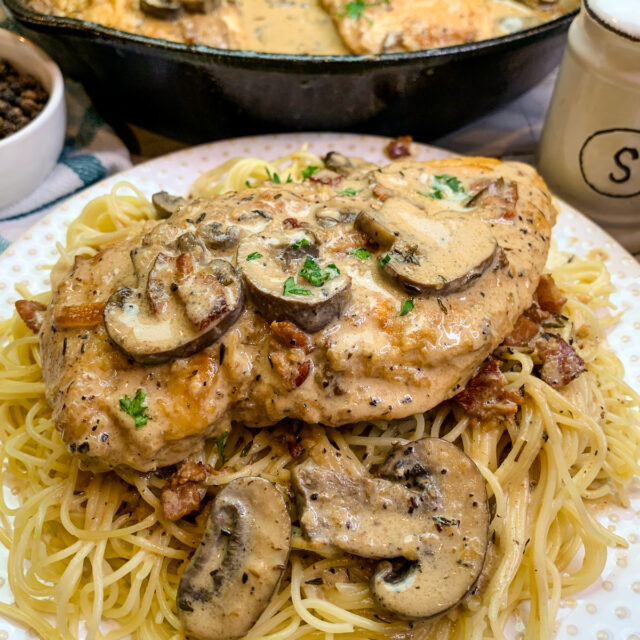
Locate an element on the screen. The width and height of the screenshot is (640, 640). dishcloth is located at coordinates (98, 154).